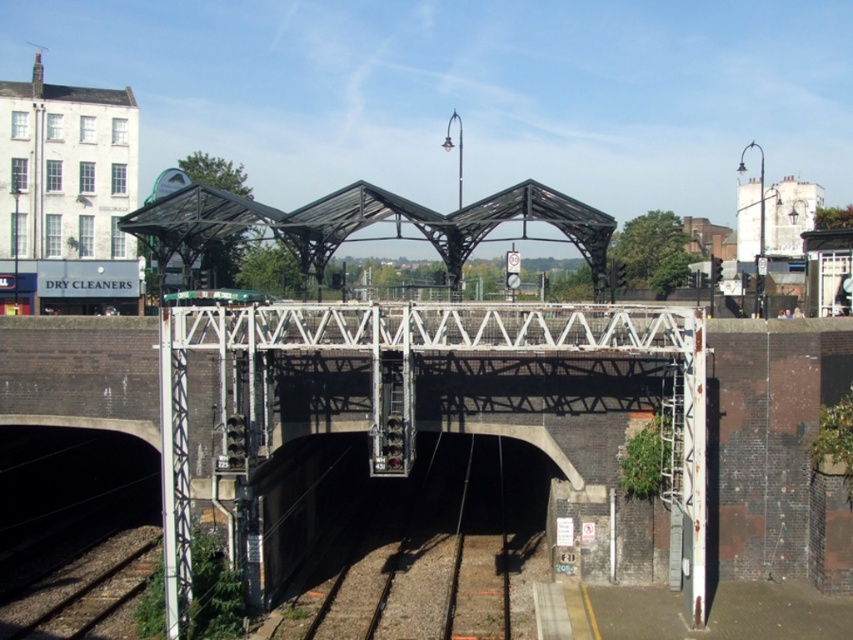
You are a maintenance worker checking the clearance under the railway overpass. You see the black metal train track at center and the green matte train at center. Which object is lower in height?

The black metal train track at center has a lesser height compared to the green matte train at center, so the black metal train track at center is lower in height.